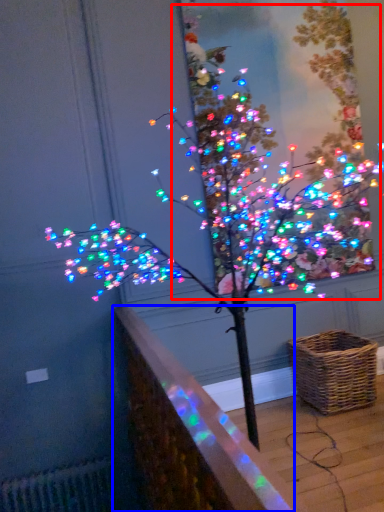
Question: Which object is closer to the camera taking this photo, christmas tree (highlighted by a red box) or ledge (highlighted by a blue box)?

Choices:
 (A) christmas tree
 (B) ledge

Answer: (B)